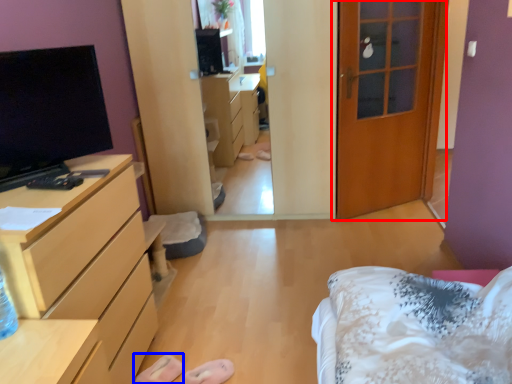
Question: Which object is further to the camera taking this photo, door (highlighted by a red box) or shoe (highlighted by a blue box)?

Choices:
 (A) door
 (B) shoe

Answer: (A)